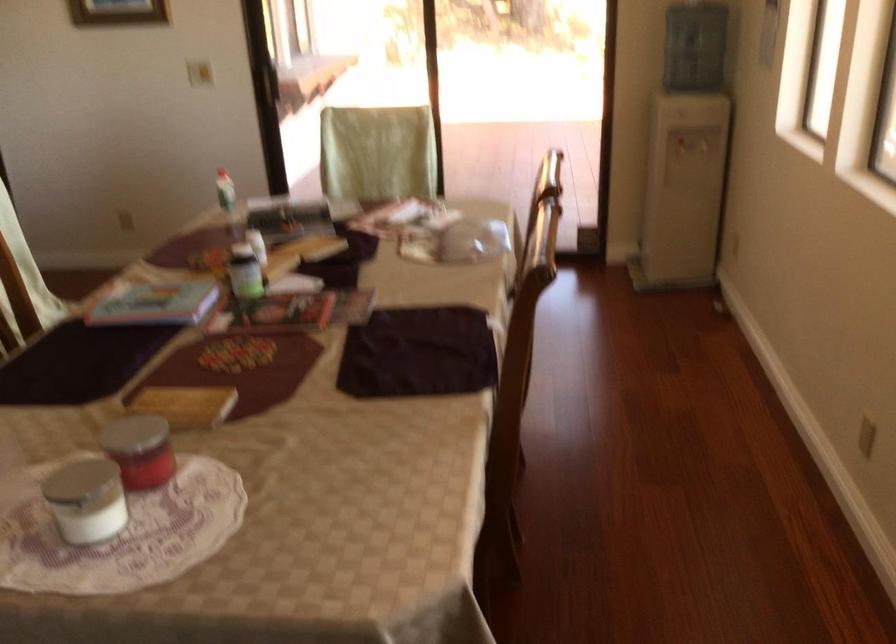
Find where to lift the blue water bottle. Please return your answer as a coordinate pair (x, y).

(245, 272)